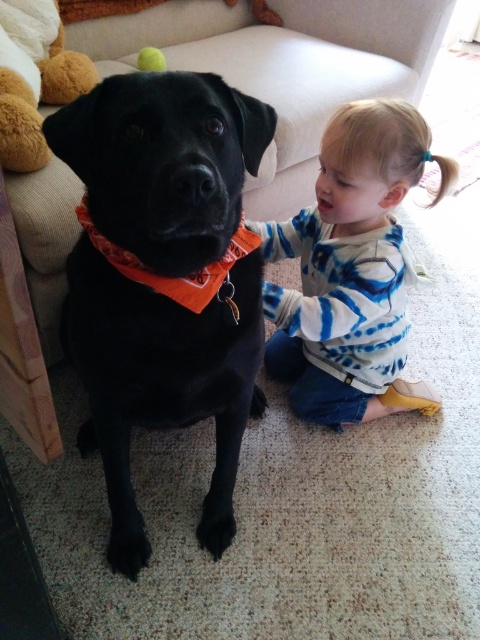
Can you confirm if blue tie-dye shirt at lower right is taller than soft plush toy at left?

Correct, blue tie-dye shirt at lower right is much taller as soft plush toy at left.

Who is lower down, blue tie-dye shirt at lower right or soft plush toy at left?

Positioned lower is blue tie-dye shirt at lower right.

Who is more forward, (362, 328) or (24, 88)?

Point (362, 328) is in front.

Image resolution: width=480 pixels, height=640 pixels. In order to click on blue tie-dye shirt at lower right in this screenshot , I will do `click(348, 266)`.

This screenshot has height=640, width=480. What do you see at coordinates (34, 77) in the screenshot?
I see `soft plush toy at left` at bounding box center [34, 77].

This screenshot has width=480, height=640. What do you see at coordinates (34, 77) in the screenshot? I see `soft plush toy at left` at bounding box center [34, 77].

Where is `soft plush toy at left`? The width and height of the screenshot is (480, 640). soft plush toy at left is located at coordinates (34, 77).

Does black matte dog at center have a lesser height compared to soft plush toy at left?

In fact, black matte dog at center may be taller than soft plush toy at left.

Does black matte dog at center appear on the left side of soft plush toy at left?

In fact, black matte dog at center is to the right of soft plush toy at left.

The image size is (480, 640). Identify the location of black matte dog at center. (164, 278).